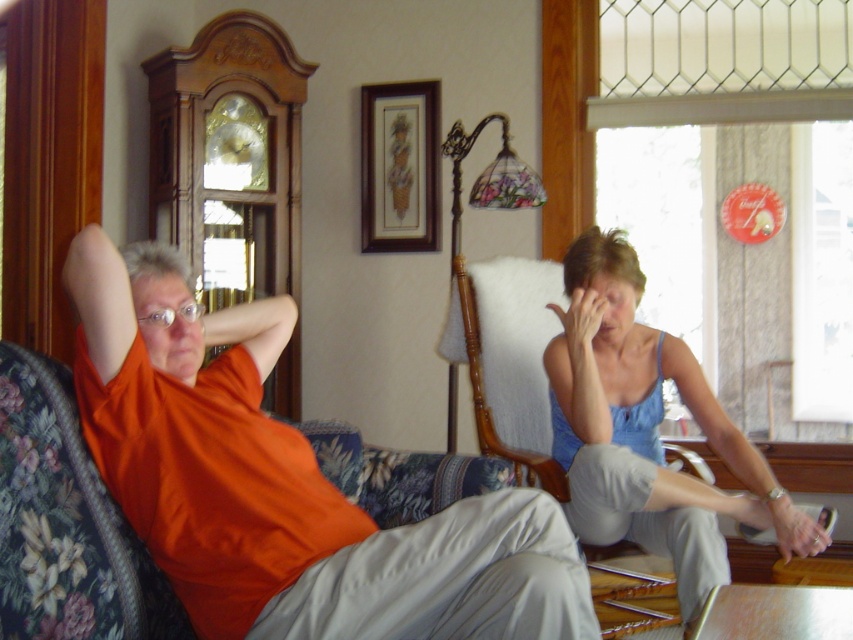
Question: Does orange cotton shirt at left lie behind blue fabric tank top at lower right?

Choices:
 (A) yes
 (B) no

Answer: (B)

Question: Does orange cotton shirt at left appear on the left side of light blue fabric armchair at center?

Choices:
 (A) no
 (B) yes

Answer: (B)

Question: Based on their relative distances, which object is farther from the orange cotton shirt at left?

Choices:
 (A) blue fabric tank top at lower right
 (B) wooden picture frame at upper center
 (C) light blue fabric armchair at center

Answer: (B)

Question: Does blue fabric tank top at lower right have a smaller size compared to light blue fabric armchair at center?

Choices:
 (A) yes
 (B) no

Answer: (B)

Question: Based on their relative distances, which object is nearer to the light blue fabric armchair at center?

Choices:
 (A) blue fabric tank top at lower right
 (B) orange cotton shirt at left

Answer: (A)

Question: Which point is farther to the camera?

Choices:
 (A) orange cotton shirt at left
 (B) light blue fabric armchair at center
 (C) blue fabric tank top at lower right

Answer: (B)